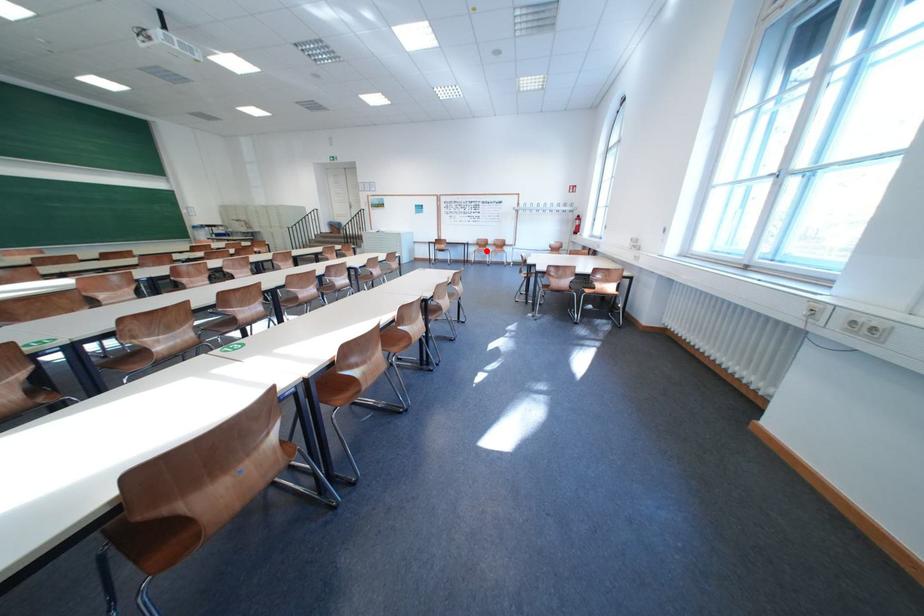
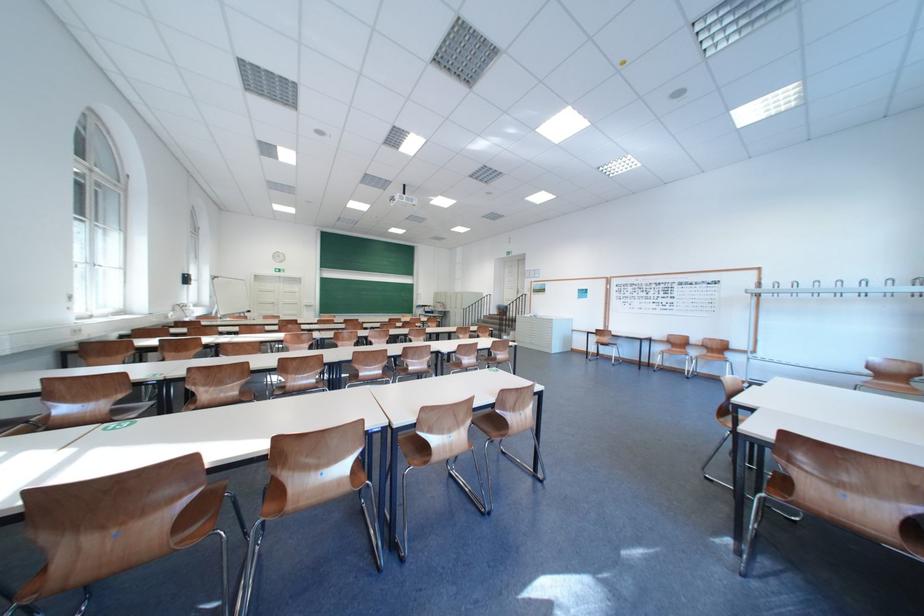
In the second image, find the point that corresponds to the highlighted location in the first image.

(673, 350)